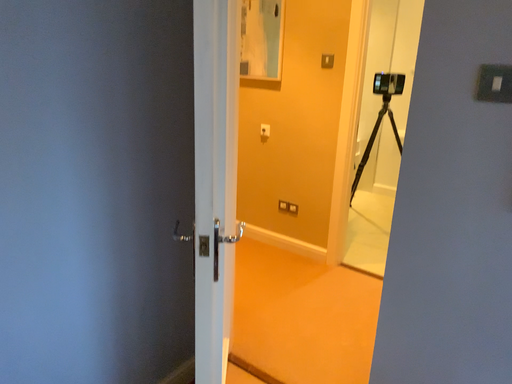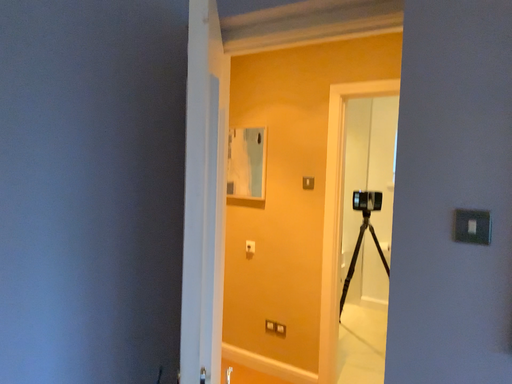
Question: How did the camera likely rotate when shooting the video?

Choices:
 (A) rotated upward
 (B) rotated downward

Answer: (A)